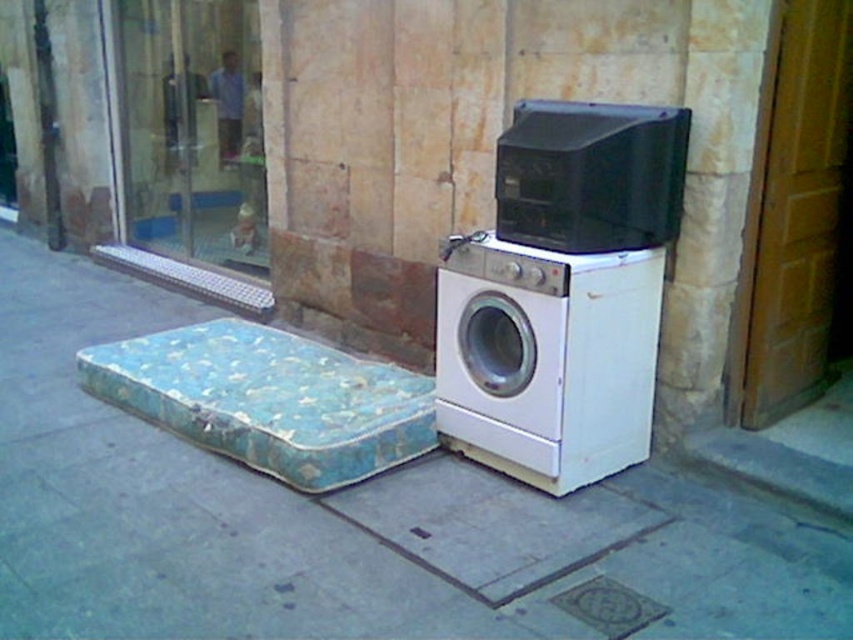
Question: Does white matte pavement at lower center appear on the left side of white matte washing machine at lower right?

Choices:
 (A) yes
 (B) no

Answer: (A)

Question: Does white matte washing machine at lower right appear under blue fabric mattress at lower left?

Choices:
 (A) no
 (B) yes

Answer: (A)

Question: Among these points, which one is farthest from the camera?

Choices:
 (A) (636, 547)
 (B) (589, 220)

Answer: (B)

Question: Which object is farther from the camera taking this photo?

Choices:
 (A) white matte pavement at lower center
 (B) gray concrete curb at lower right

Answer: (B)

Question: Is white matte washing machine at lower right wider than metallic grid at lower left?

Choices:
 (A) no
 (B) yes

Answer: (A)

Question: Based on their relative distances, which object is farther from the gray concrete curb at lower right?

Choices:
 (A) white matte washing machine at lower right
 (B) blue fabric mattress at lower left

Answer: (B)